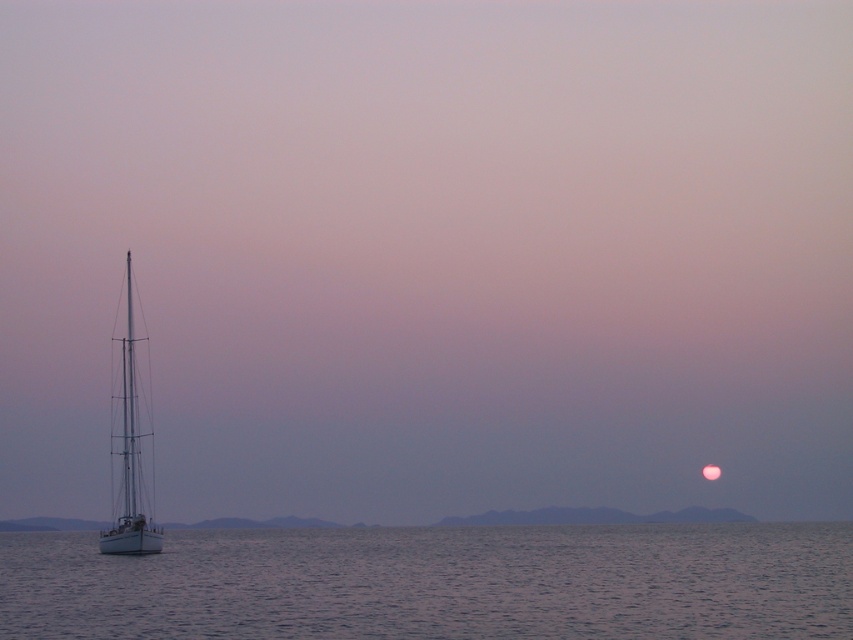
You are standing at the point labeled point (462, 570) and want to walk to the point labeled point (126, 272). Which direction should you move to get closer to your destination?

You should move towards the lower left direction because point (126, 272) is located lower and to the left relative to point (462, 570).

You are standing on the beach looking at the clear water at lower left and the white matte sailboat at left. Which object is closer to the right edge of the image?

The clear water at lower left is positioned on the right side of white matte sailboat at left, so the clear water at lower left is closer to the right edge of the image.

You are an observer standing on the shore looking out at the seascape. You notice the clear water at lower left and the white matte sailboat at left. Which object is located lower in the image?

The clear water at lower left is positioned under the white matte sailboat at left, so it is located lower in the image.